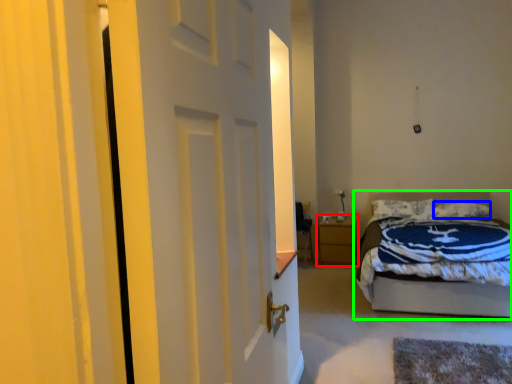
Question: Estimate the real-world distances between objects in this image. Which object is farther from nightstand (highlighted by a red box), pillow (highlighted by a blue box) or bed (highlighted by a green box)?

Choices:
 (A) pillow
 (B) bed

Answer: (B)